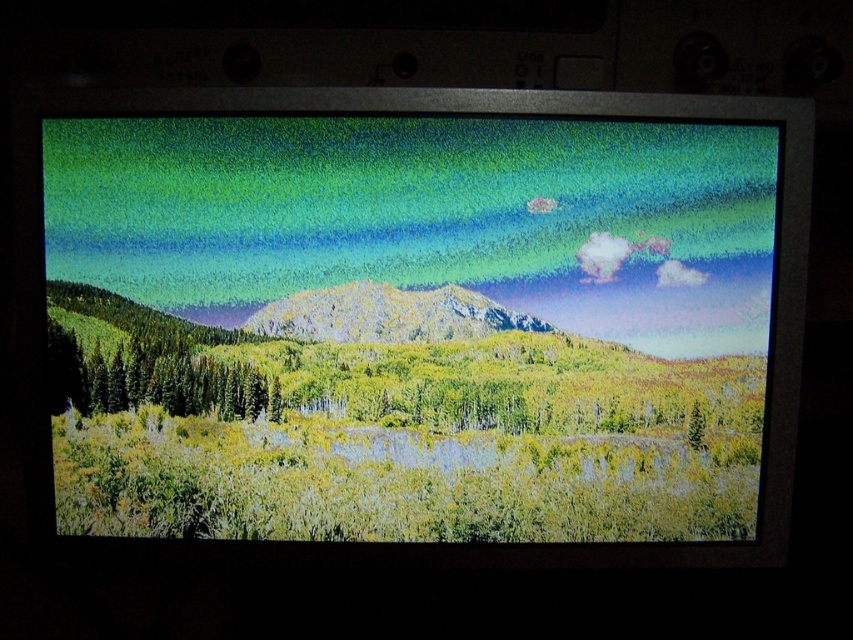
Question: Estimate the real-world distances between objects in this image. Which object is farther from the rocky mountain at center?

Choices:
 (A) green matte trees at left
 (B) green matte landscape at center

Answer: (A)

Question: Which point is farther to the camera?

Choices:
 (A) rocky mountain at center
 (B) green matte landscape at center

Answer: (A)

Question: Can you confirm if green matte landscape at center is positioned above rocky mountain at center?

Choices:
 (A) no
 (B) yes

Answer: (A)

Question: Does green matte landscape at center have a larger size compared to green matte trees at left?

Choices:
 (A) no
 (B) yes

Answer: (B)

Question: Which point is closer to the camera?

Choices:
 (A) green matte trees at left
 (B) rocky mountain at center

Answer: (A)

Question: Is green matte landscape at center positioned in front of rocky mountain at center?

Choices:
 (A) yes
 (B) no

Answer: (A)